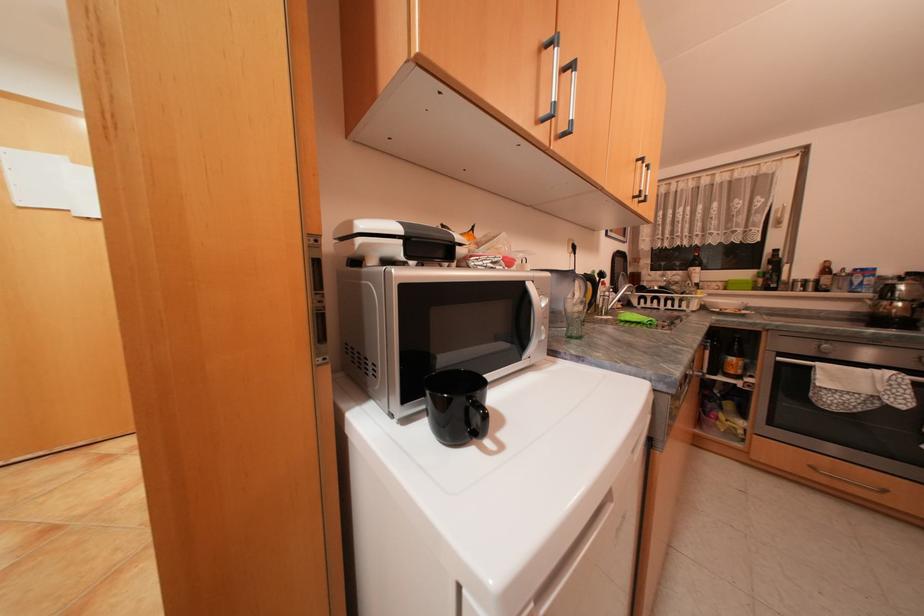
The image size is (924, 616). What are the coordinates of `drawer handle` in the screenshot? It's located at (849, 480).